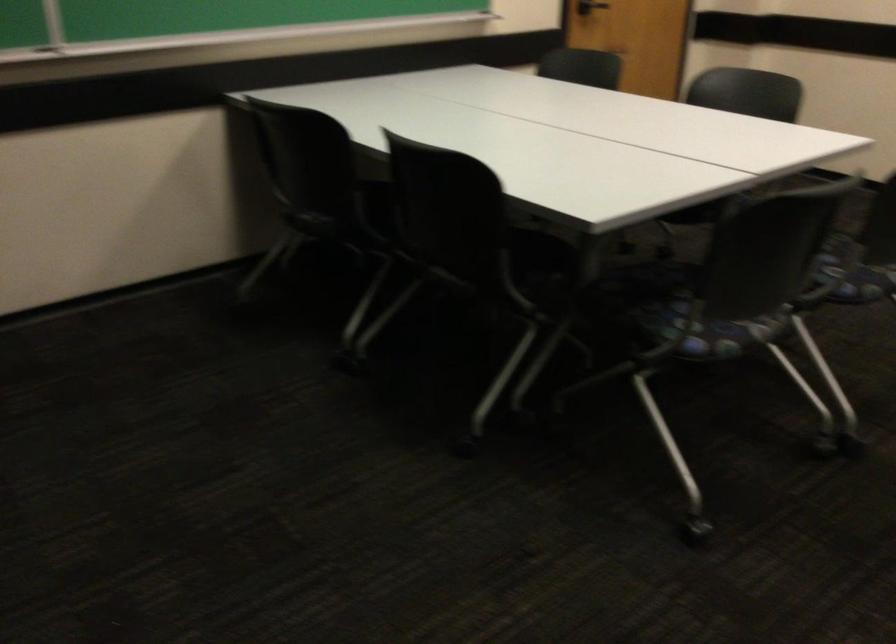
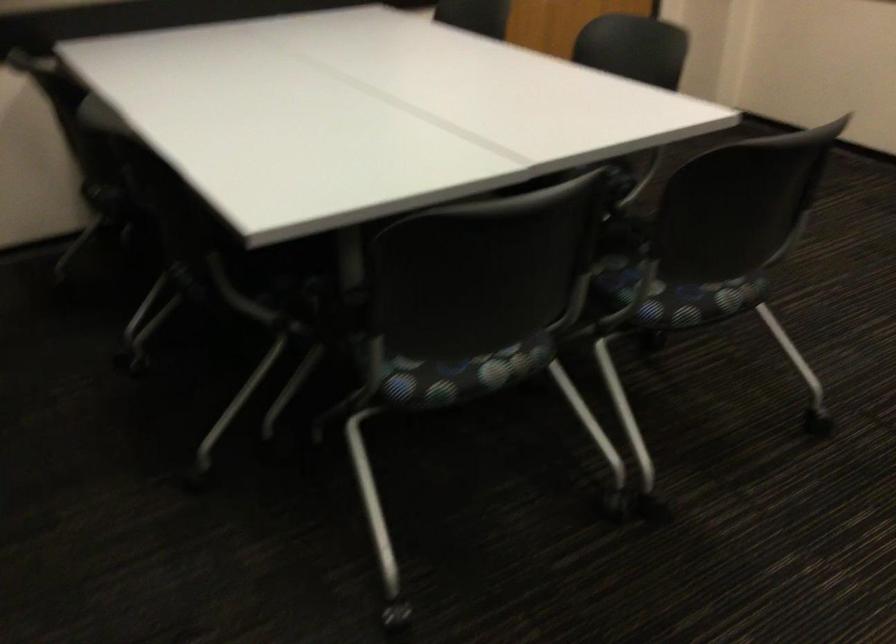
Question: Based on the continuous images, in which direction is the camera rotating? Reply with the corresponding letter.

Choices:
 (A) Left
 (B) Right
 (C) Up
 (D) Down

Answer: (D)